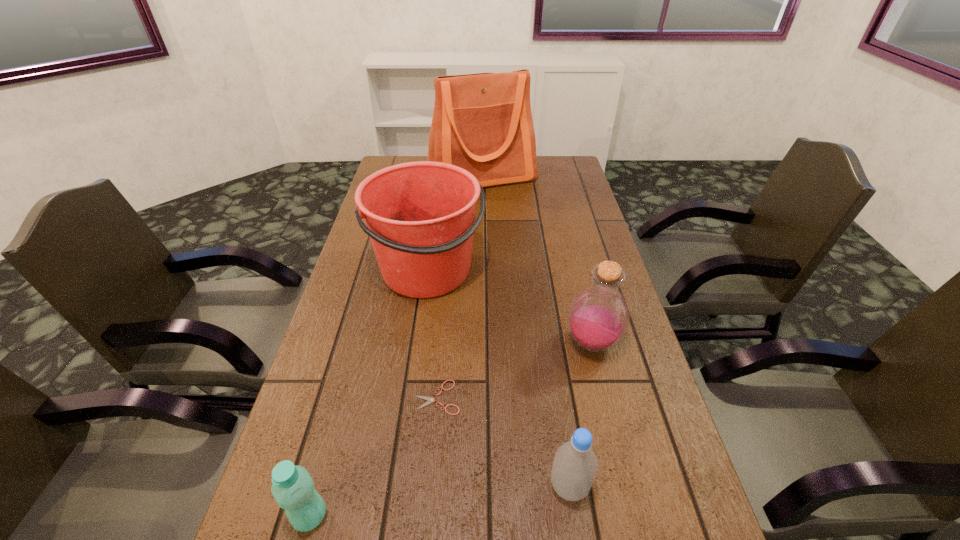
In order to click on vacant space that satisfies the following two spatial constraints: 1. on the back side of the leftmost bottle; 2. on the right side of the third nearest object in this screenshot , I will do `click(343, 397)`.